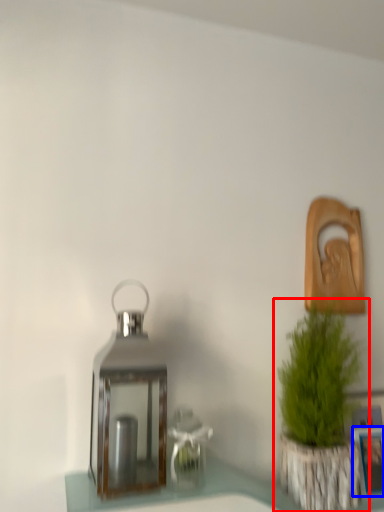
Question: Which point is closer to the camera, houseplant (highlighted by a red box) or picture frame (highlighted by a blue box)?

Choices:
 (A) houseplant
 (B) picture frame

Answer: (A)